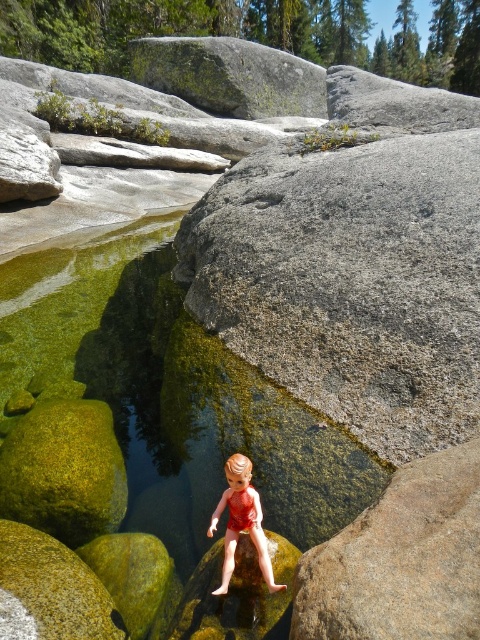
You are a small frog hopping between the green mossy rock at upper center and the green mossy rock at center. Which rock should you jump to if you want to land on the bigger one?

The green mossy rock at upper center is larger in size compared to the green mossy rock at center, so you should jump to the green mossy rock at upper center.

You are a hiker who wants to cross the pool of water at the center of the rocky landscape. You see a green mossy water at center located at point (169, 392). Is there a safe path around the green mossy water at center to reach the other side?

The green mossy water at center is located at point (169, 392), so there might be a safe path around it depending on the surrounding rocks. However, the description does not provide information about the path or obstacles, so it is uncertain.